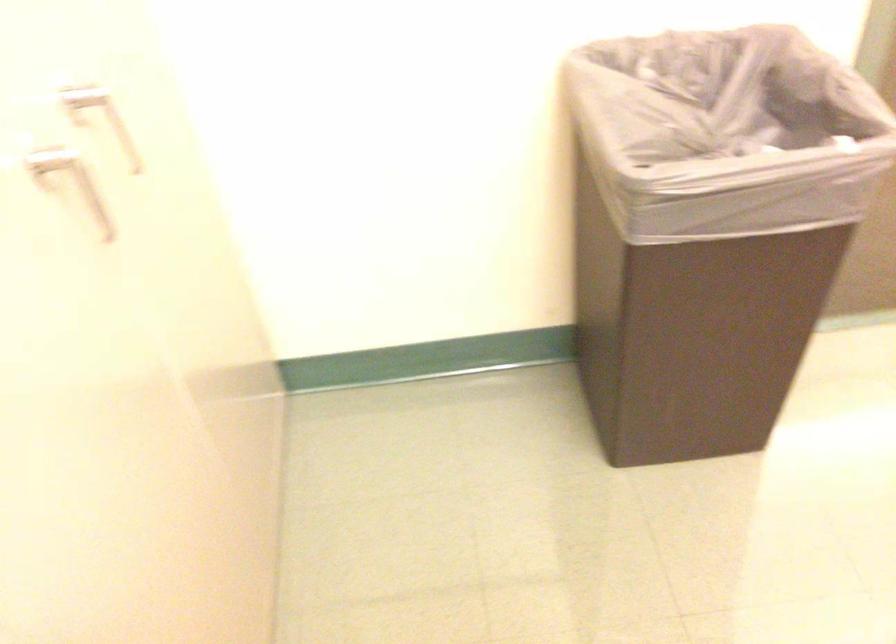
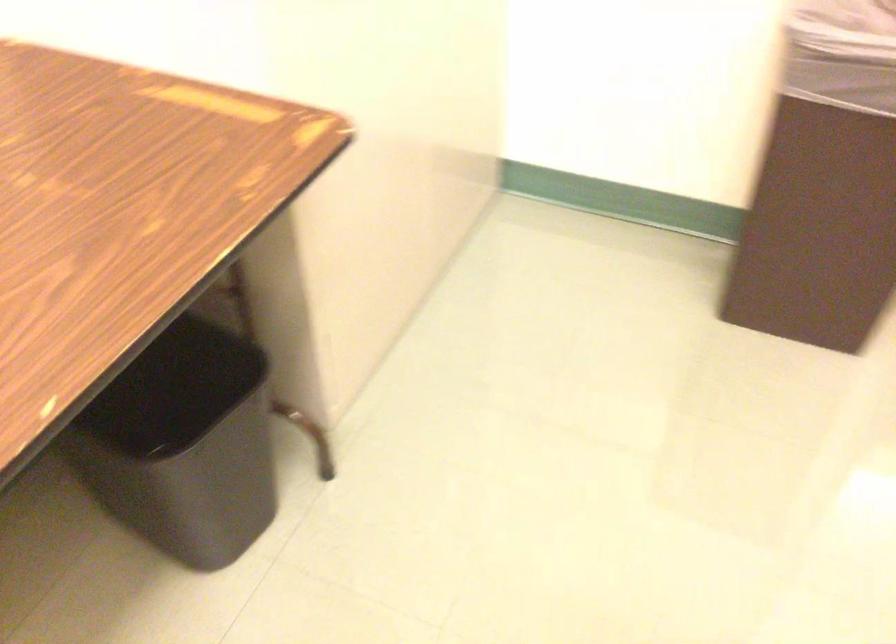
The images are taken continuously from a first-person perspective. In which direction are you moving?

The movement direction of the cameraman is right, backward.